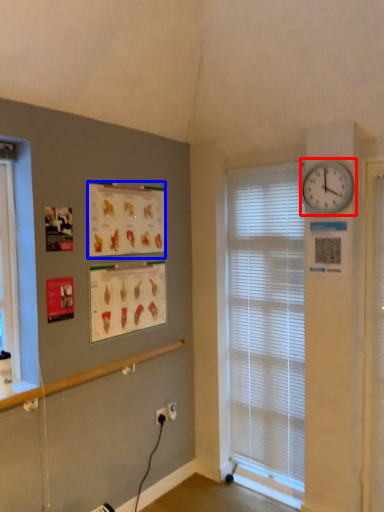
Question: Which point is closer to the camera, wall clock (highlighted by a red box) or poster page (highlighted by a blue box)?

Choices:
 (A) wall clock
 (B) poster page

Answer: (A)